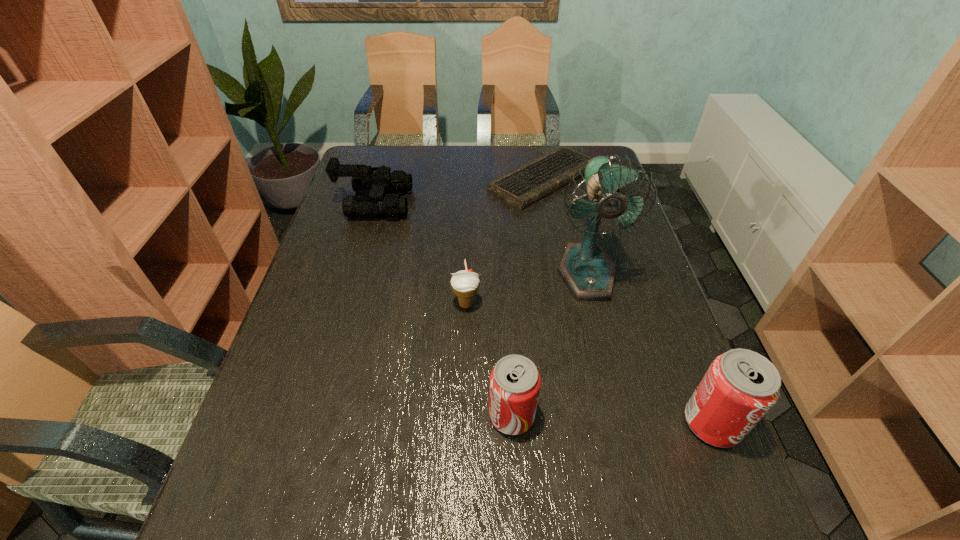
Please point a vacant point for placing a soda can on the left. Please provide its 2D coordinates. Your answer should be formatted as a tuple, i.e. [(x, y)], where the tuple contains the x and y coordinates of a point satisfying the conditions above.

[(316, 408)]